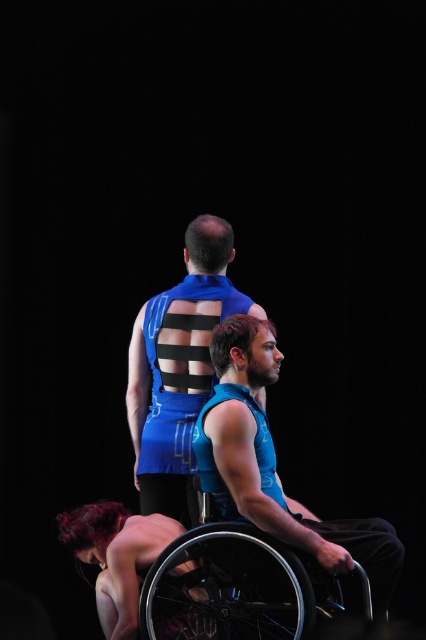
Does blue fabric vest at center have a larger size compared to blue matte vest at center?

No.

Between blue fabric vest at center and blue matte vest at center, which one appears on the left side from the viewer's perspective?

From the viewer's perspective, blue matte vest at center appears more on the left side.

Identify the location of blue fabric vest at center. The image size is (426, 640). (275, 465).

Between blue matte vest at center and black metallic wheelchair at lower right, which one appears on the left side from the viewer's perspective?

Positioned to the left is blue matte vest at center.

Does point (155, 384) come in front of point (262, 582)?

That is False.

Is point (178, 492) behind point (256, 602)?

Yes, it is.

Identify the location of blue matte vest at center. (178, 369).

Is blue matte vest at center smaller than smooth skin nude woman at lower left?

No, blue matte vest at center is not smaller than smooth skin nude woman at lower left.

Between blue matte vest at center and smooth skin nude woman at lower left, which one is positioned lower?

smooth skin nude woman at lower left is lower down.

The image size is (426, 640). I want to click on blue matte vest at center, so click(178, 369).